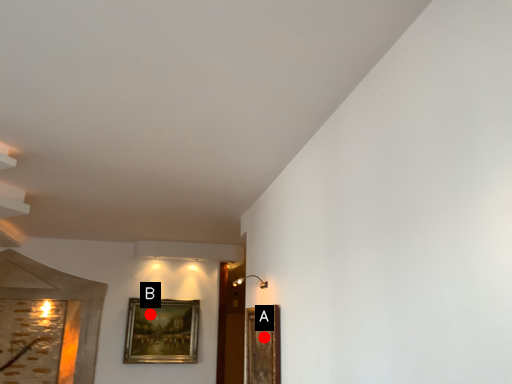
Question: Two points are circled on the image, labeled by A and B beside each circle. Which point is closer to the camera?

Choices:
 (A) A is closer
 (B) B is closer

Answer: (A)